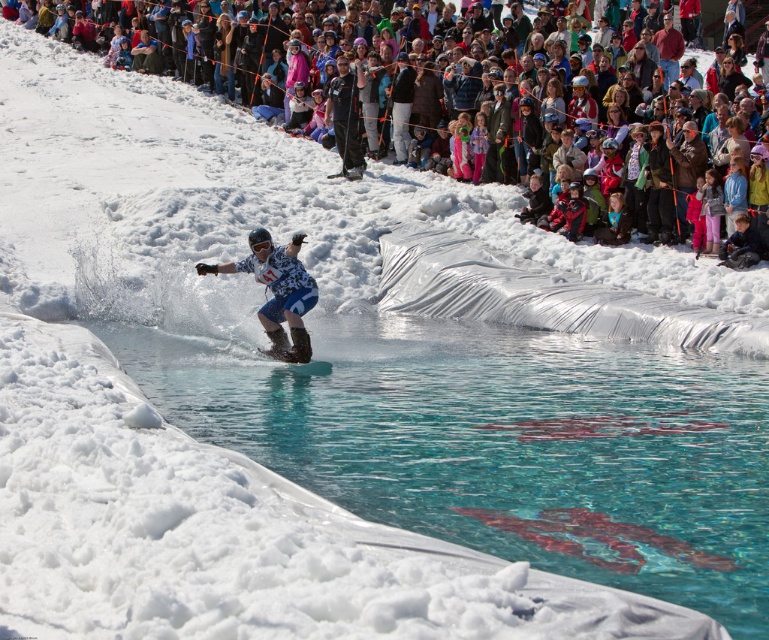
Does point (145, 186) come closer to viewer compared to point (581, 321)?

That is False.

Can you confirm if multicolored fabric crowd at upper center is shorter than transparent plastic ramp at center?

No, multicolored fabric crowd at upper center is not shorter than transparent plastic ramp at center.

Image resolution: width=769 pixels, height=640 pixels. What do you see at coordinates (248, 196) in the screenshot?
I see `multicolored fabric crowd at upper center` at bounding box center [248, 196].

The image size is (769, 640). I want to click on multicolored fabric crowd at upper center, so click(x=248, y=196).

Does clear blue water at center have a larger size compared to white snowboard at center?

Yes, clear blue water at center is bigger than white snowboard at center.

In the scene shown: Is clear blue water at center thinner than white snowboard at center?

Incorrect, clear blue water at center's width is not less than white snowboard at center's.

Which is in front, point (714, 608) or point (217, 272)?

Point (714, 608) is in front.

Where is `clear blue water at center`? Image resolution: width=769 pixels, height=640 pixels. clear blue water at center is located at coordinates (495, 442).

From the picture: Can you confirm if multicolored fabric crowd at upper center is positioned below white snowboard at center?

No.

Who is higher up, multicolored fabric crowd at upper center or white snowboard at center?

Positioned higher is multicolored fabric crowd at upper center.

The width and height of the screenshot is (769, 640). What do you see at coordinates (248, 196) in the screenshot?
I see `multicolored fabric crowd at upper center` at bounding box center [248, 196].

The width and height of the screenshot is (769, 640). In order to click on multicolored fabric crowd at upper center in this screenshot , I will do `click(248, 196)`.